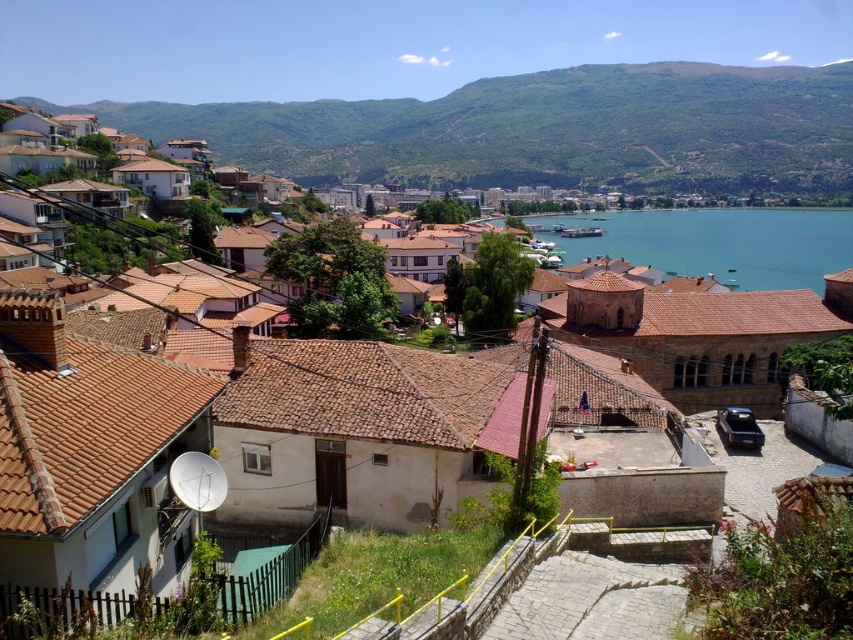
You are planning to build a small garden on the green grassy hillside at upper center and the blue water at center. Based on the height difference between them, which location would be more suitable for a garden that requires elevated planting beds?

The green grassy hillside at upper center is more suitable for elevated planting beds since it has a greater height compared to the blue water at center.

You are standing at the edge of the town looking towards the mountain range. You see the green grassy hillside at upper center and the blue water at center. Which of these two features is located higher in the image?

The green grassy hillside at upper center is above the blue water at center in the image.

You are standing at the center of the paved pathway bordered by yellow rail in the middle ground of the town. Looking towards the upper center, you notice a point marked at coordinates (546, 131). What type of terrain feature does this point represent in the scene?

The point at (546, 131) corresponds to a green grassy hillside at upper center.